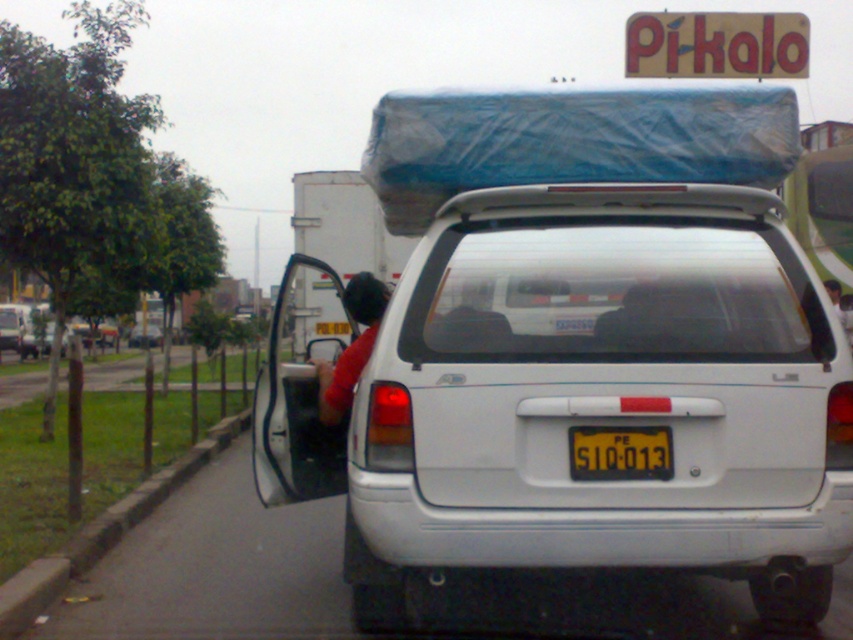
You are driving a car and want to park next to the white matte truck at center and the white matte van at center. Which one has more space available on its side for your car to fit alongside?

The white matte truck at center has a larger width than the white matte van at center, so there is more space on the side of the white matte truck at center to park your car next to it.

You are a delivery driver who needs to park your van between the gray concrete curb at lower left and the edge of the road. The van is 4.3 meters long. Can you safely park the van in this space without overhanging the curb?

The distance between the gray concrete curb at lower left and the edge of the road is 4.36 meters. Since the van is 4.3 meters long, there is enough space to park safely without overhanging the curb.